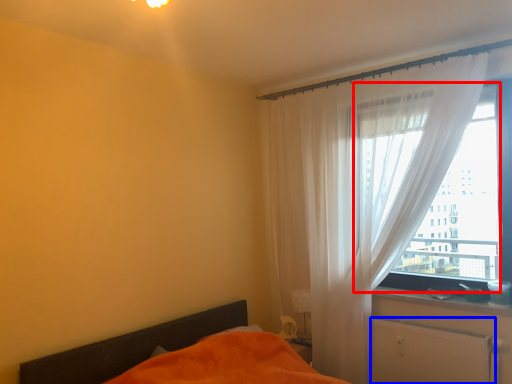
Question: Which of the following is the farthest to the observer, window (highlighted by a red box) or radiator (highlighted by a blue box)?

Choices:
 (A) window
 (B) radiator

Answer: (A)